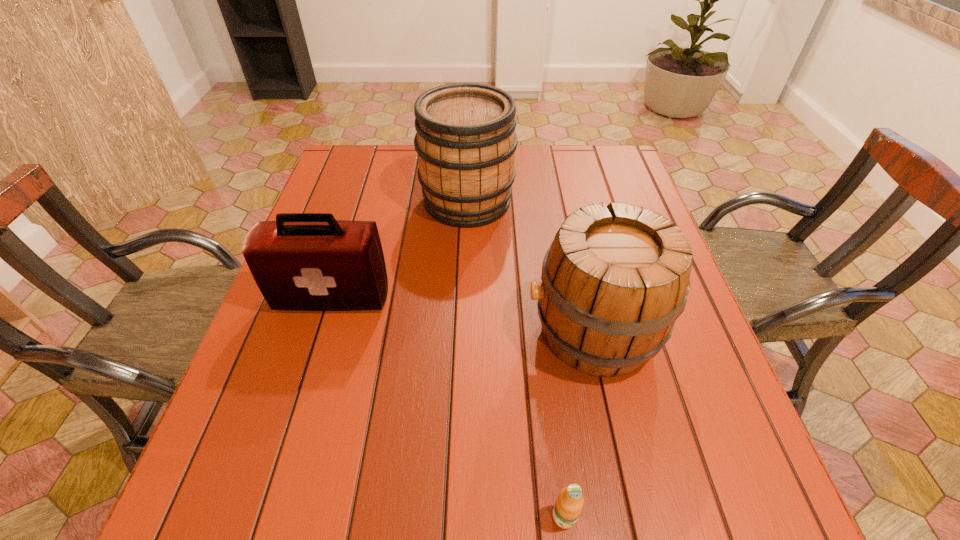
Find the location of a particular element. The image size is (960, 540). vacant space at the far right corner of the desktop is located at coordinates (617, 152).

Locate an element on the screen. free space between the nearer cider and the farther cider is located at coordinates (530, 267).

Locate an element on the screen. This screenshot has width=960, height=540. vacant area between the farthest object and the first aid kit is located at coordinates (400, 249).

The width and height of the screenshot is (960, 540). I want to click on unoccupied position between the shortest object and the first aid kit, so click(x=448, y=407).

Locate an element on the screen. The width and height of the screenshot is (960, 540). free space that is in between the farthest object and the orange juice is located at coordinates (516, 359).

The image size is (960, 540). Identify the location of vacant point located between the farther cider and the orange juice. (516, 359).

Identify the location of vacant point located between the nearest object and the farther cider. The image size is (960, 540). (516, 359).

At what (x,y) coordinates should I click in order to perform the action: click on vacant space that's between the nearer cider and the farthest object. Please return your answer as a coordinate pair (x, y). The width and height of the screenshot is (960, 540). Looking at the image, I should click on (530, 267).

Find the location of a particular element. vacant area that lies between the nearer cider and the farthest object is located at coordinates (530, 267).

Where is `vacant space in between the nearest object and the nearer cider`? vacant space in between the nearest object and the nearer cider is located at coordinates (579, 424).